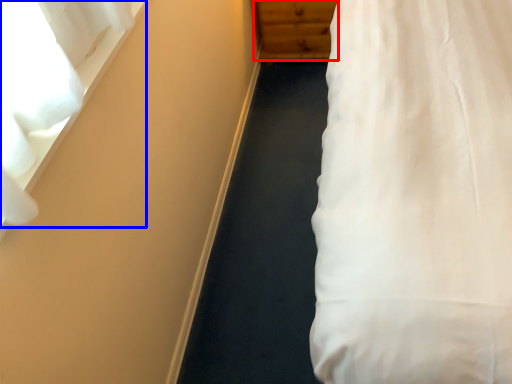
Question: Which object appears closest to the camera in this image, dresser (highlighted by a red box) or curtain (highlighted by a blue box)?

Choices:
 (A) dresser
 (B) curtain

Answer: (B)